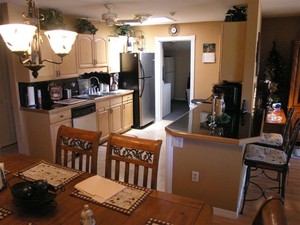
Where is `cabinets`? Image resolution: width=300 pixels, height=225 pixels. cabinets is located at coordinates click(96, 55), click(64, 76), click(51, 131), click(104, 117), click(120, 115).